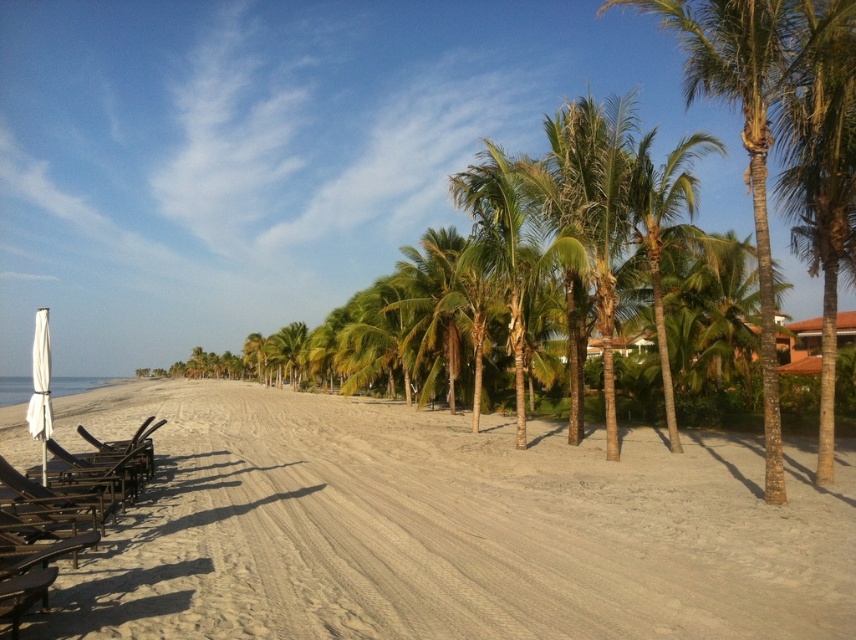
Who is positioned more to the right, wooden beach chair at left or metallic black beach chair at left?

metallic black beach chair at left

Between wooden beach chair at left and metallic black beach chair at left, which one has less height?

metallic black beach chair at left is shorter.

Is point (45, 500) farther from viewer compared to point (15, 506)?

Yes.

You are a GUI agent. You are given a task and a screenshot of the screen. Output one action in this format:
    pyautogui.click(x=<x>, y=<y>)
    Task: Click on the wooden beach chair at left
    This screenshot has width=856, height=640.
    Given the screenshot: What is the action you would take?
    pyautogui.click(x=61, y=515)

Describe the element at coordinates (444, 529) in the screenshot. Image resolution: width=856 pixels, height=640 pixels. I see `beige sandy beach at center` at that location.

Is beige sandy beach at center bigger than white fabric umbrella at left?

No, beige sandy beach at center is not bigger than white fabric umbrella at left.

Identify the location of beige sandy beach at center. (444, 529).

Which is in front, point (24, 497) or point (45, 472)?

Point (24, 497) is more forward.

Is the position of metallic black beach chair at left less distant than that of white fabric umbrella at left?

Yes, metallic black beach chair at left is in front of white fabric umbrella at left.

Is point (51, 518) positioned before point (40, 330)?

Yes, it is.

The image size is (856, 640). In order to click on metallic black beach chair at left in this screenshot , I will do `click(52, 500)`.